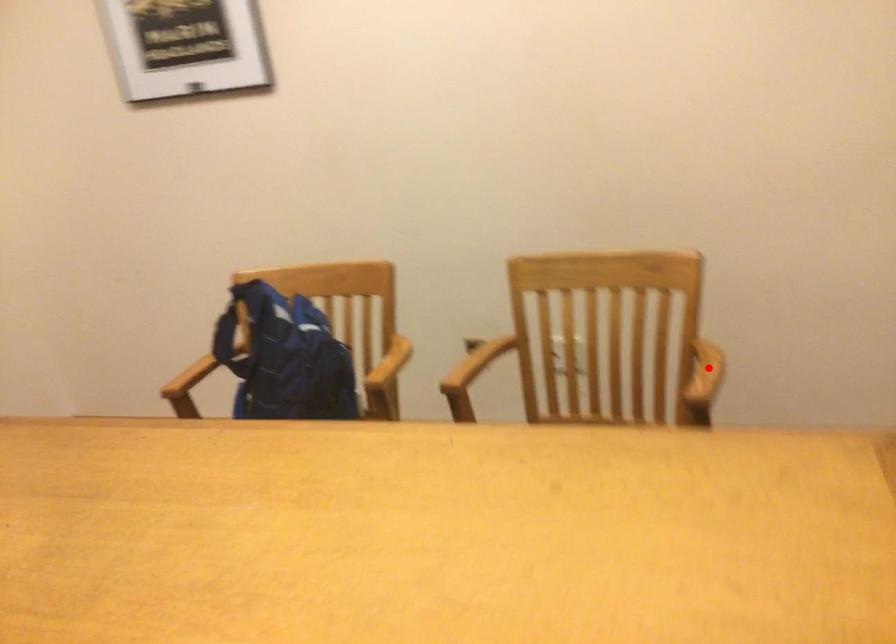
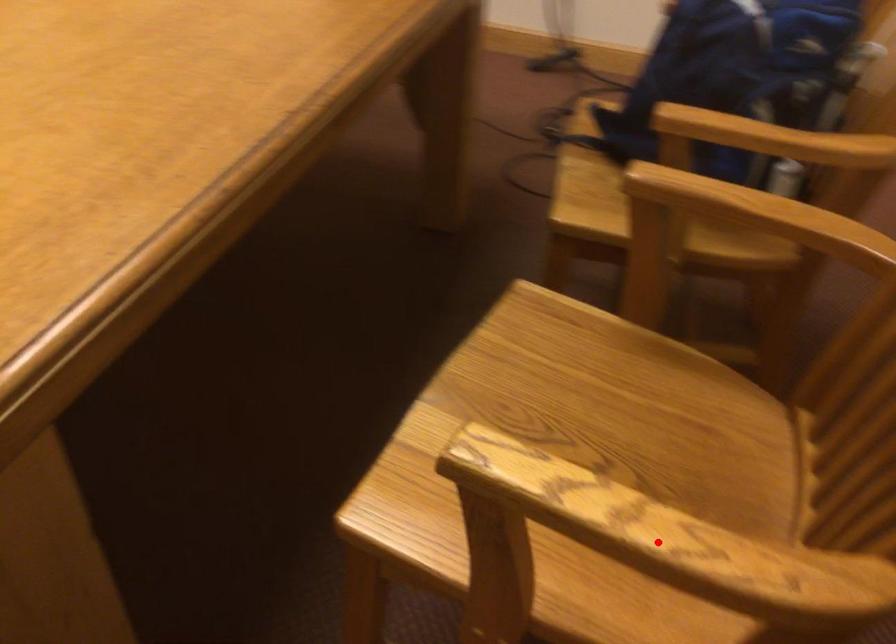
I am providing you with two images of the same scene from different viewpoints. A red point is marked on the first image and another point is marked on the second image. Does the point marked in image1 correspond to the same location as the one in image2?

Yes